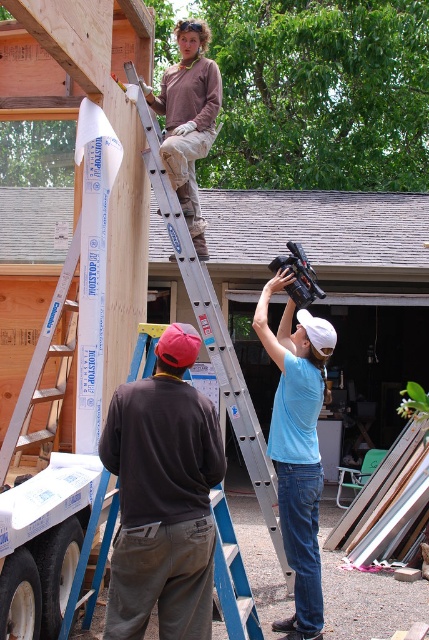
Does gray shingles at upper center appear on the right side of silver metallic ladder at upper center?

Indeed, gray shingles at upper center is positioned on the right side of silver metallic ladder at upper center.

Who is higher up, gray shingles at upper center or silver metallic ladder at upper center?

gray shingles at upper center is above.

This screenshot has height=640, width=429. Find the location of `gray shingles at upper center`. gray shingles at upper center is located at coordinates (317, 227).

Identify the location of gray shingles at upper center. (317, 227).

Locate an element on the screen. dark gray sweatshirt at lower left is located at coordinates (163, 497).

Is point (106, 632) positioned behind point (317, 401)?

That is False.

At what (x,y) coordinates should I click in order to perform the action: click on dark gray sweatshirt at lower left. Please return your answer as a coordinate pair (x, y). The image size is (429, 640). Looking at the image, I should click on (163, 497).

Is dark gray sweatshirt at lower left bigger than matte brown shirt at upper center?

Incorrect, dark gray sweatshirt at lower left is not larger than matte brown shirt at upper center.

Between point (189, 454) and point (193, 218), which one is positioned behind?

The point (193, 218) is behind.

Locate an element on the screen. This screenshot has height=640, width=429. dark gray sweatshirt at lower left is located at coordinates (163, 497).